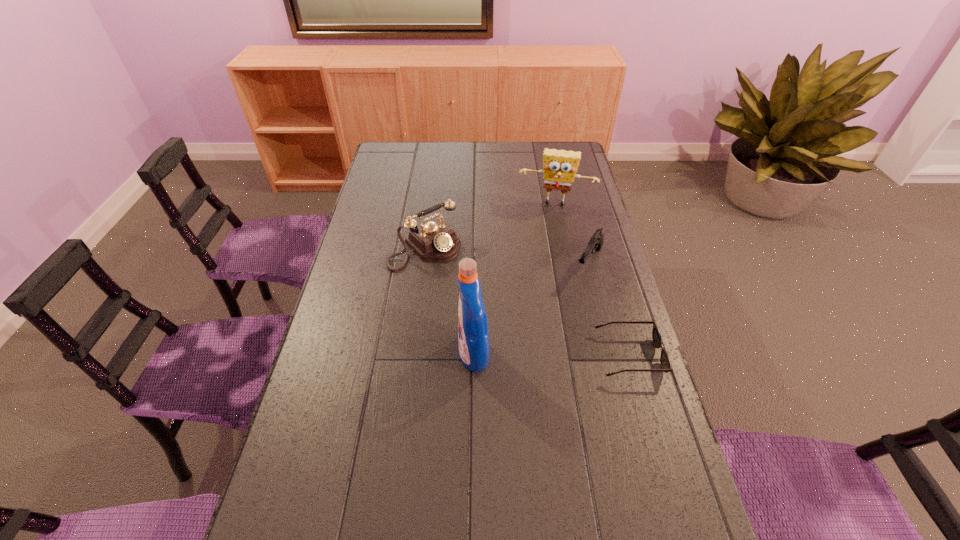
At what (x,y) coordinates should I click in order to perform the action: click on vacant space on the desktop that is between the fourth object from right to left and the sunglasses and is positioned on the dial of the telephone. Please return your answer as a coordinate pair (x, y). This screenshot has height=540, width=960. Looking at the image, I should click on (540, 355).

Image resolution: width=960 pixels, height=540 pixels. In order to click on vacant space on the desktop that is between the detergent and the shortest object and is positioned on the face of the farthest object in this screenshot , I will do `click(531, 355)`.

Where is `vacant space on the desktop that is between the detergent and the sunglasses and is positioned at the end of the barrel of the gun`? Image resolution: width=960 pixels, height=540 pixels. vacant space on the desktop that is between the detergent and the sunglasses and is positioned at the end of the barrel of the gun is located at coordinates (533, 355).